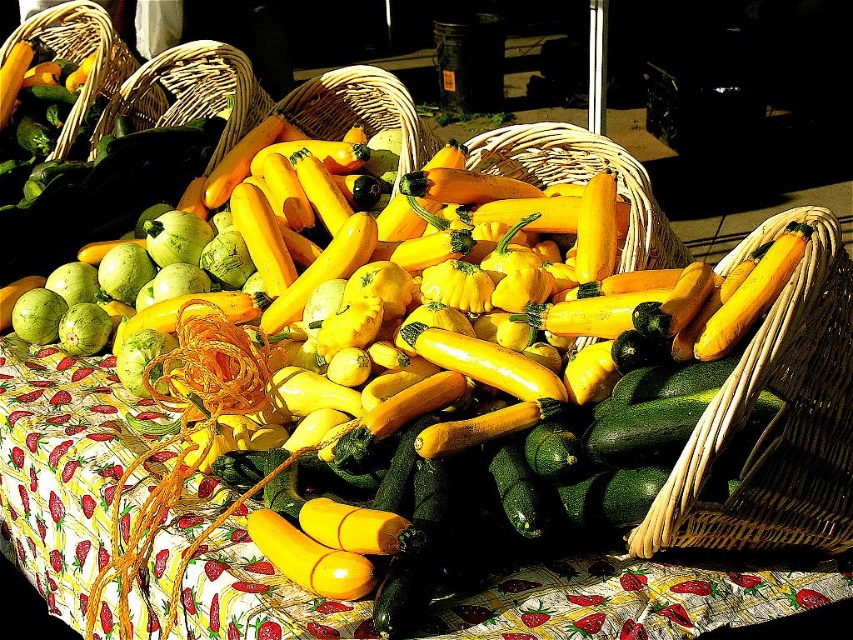
Question: Can you confirm if woven straw basket at center is wider than woven straw basket at upper left?

Choices:
 (A) yes
 (B) no

Answer: (B)

Question: Estimate the real-world distances between objects in this image. Which object is closer to the strawberry-patterned fabric at center?

Choices:
 (A) woven wicker basket at right
 (B) woven straw basket at upper left
 (C) woven straw basket at center

Answer: (A)

Question: Which point is closer to the camera?

Choices:
 (A) (811, 572)
 (B) (215, 76)
 (C) (795, 524)
 (D) (567, 145)

Answer: (C)

Question: Among these objects, which one is farthest from the camera?

Choices:
 (A) strawberry-patterned fabric at center
 (B) woven straw basket at center
 (C) woven wicker basket at right

Answer: (B)

Question: Does strawberry-patterned fabric at center have a smaller size compared to woven straw basket at center?

Choices:
 (A) no
 (B) yes

Answer: (A)

Question: Is strawberry-patterned fabric at center thinner than woven straw basket at upper left?

Choices:
 (A) yes
 (B) no

Answer: (B)